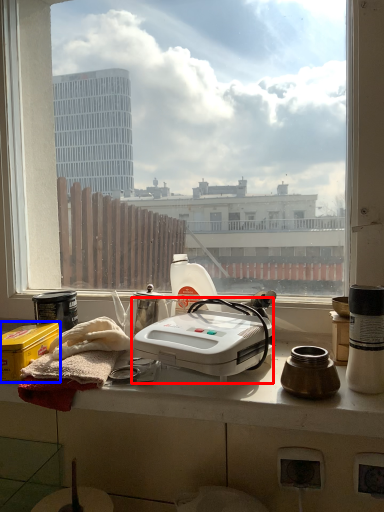
Question: Which object appears farthest to the camera in this image, kitchen appliance (highlighted by a red box) or box (highlighted by a blue box)?

Choices:
 (A) kitchen appliance
 (B) box

Answer: (B)